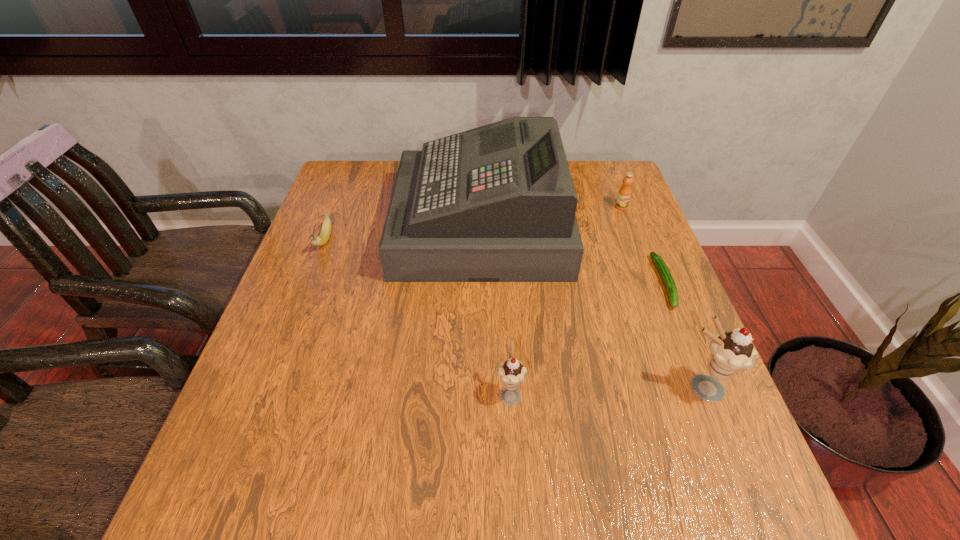
What are the coordinates of `vacant space located on the back of the taller icecream` in the screenshot? It's located at (653, 268).

You are a GUI agent. You are given a task and a screenshot of the screen. Output one action in this format:
    pyautogui.click(x=<x>, y=<y>)
    Task: Click on the blank space located 0.190m on the front label of the orange juice
    This screenshot has height=540, width=960.
    Given the screenshot: What is the action you would take?
    pyautogui.click(x=639, y=255)

The height and width of the screenshot is (540, 960). What are the coordinates of `free space located on the front-facing side of the cash register` in the screenshot? It's located at (318, 225).

Image resolution: width=960 pixels, height=540 pixels. I want to click on vacant region located 0.110m on the front-facing side of the cash register, so click(357, 225).

Identify the location of vacant space located on the front-facing side of the cash register. (318, 225).

At what (x,y) coordinates should I click in order to perform the action: click on vacant space located at the stem of the leftmost object. Please return your answer as a coordinate pair (x, y). Looking at the image, I should click on (297, 313).

The height and width of the screenshot is (540, 960). What are the coordinates of `vacant space located 0.070m on the front-facing side of the shortest object` in the screenshot? It's located at (686, 336).

Locate an element on the screen. orange juice at the far edge is located at coordinates (624, 194).

In order to click on cash register present at the far edge in this screenshot , I will do `click(497, 203)`.

The width and height of the screenshot is (960, 540). In order to click on object that is at the left edge in this screenshot , I will do `click(325, 233)`.